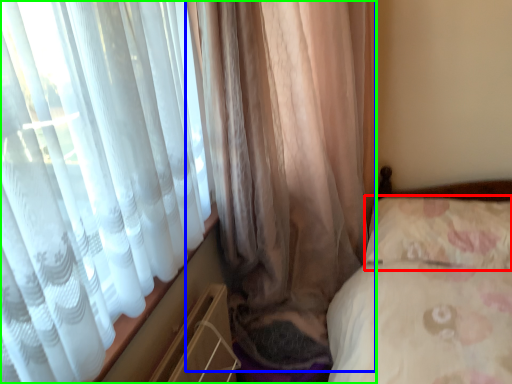
Question: Which object is the farthest from pillow (highlighted by a red box)? Choose among these: curtain (highlighted by a blue box) or curtain (highlighted by a green box).

Choices:
 (A) curtain
 (B) curtain

Answer: (B)